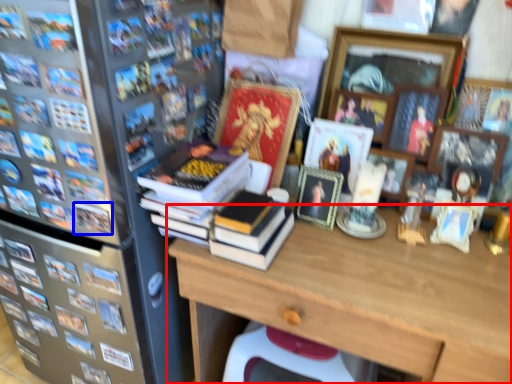
Question: Among these objects, which one is nearest to the camera, desk (highlighted by a red box) or book (highlighted by a blue box)?

Choices:
 (A) desk
 (B) book

Answer: (A)